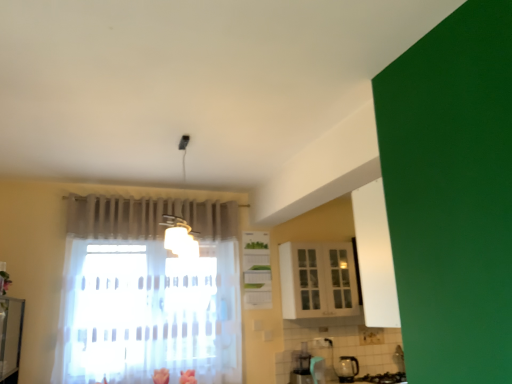
Question: In terms of height, does white glossy cabinet at center, the 1th cabinetry viewed from the left, look taller or shorter compared to white glossy cabinet at upper center, acting as the first cabinetry starting from the right?

Choices:
 (A) tall
 (B) short

Answer: (A)

Question: Based on their sizes in the image, would you say white glossy cabinet at center, the 1th cabinetry viewed from the left, is bigger or smaller than white glossy cabinet at upper center, the 2th cabinetry in the left-to-right sequence?

Choices:
 (A) big
 (B) small

Answer: (B)

Question: Estimate the real-world distances between objects in this image. Which object is farther from the white glossy cabinet at center, the 1th cabinetry viewed from the left?

Choices:
 (A) white glossy cabinet at upper center, the 2th cabinetry in the left-to-right sequence
 (B) transparent glass kettle at lower right

Answer: (B)

Question: Which of these objects is positioned closest to the white glossy cabinet at upper center, the 2th cabinetry in the left-to-right sequence?

Choices:
 (A) transparent glass kettle at lower right
 (B) white glossy cabinet at center, the 2th cabinetry viewed from the right

Answer: (B)